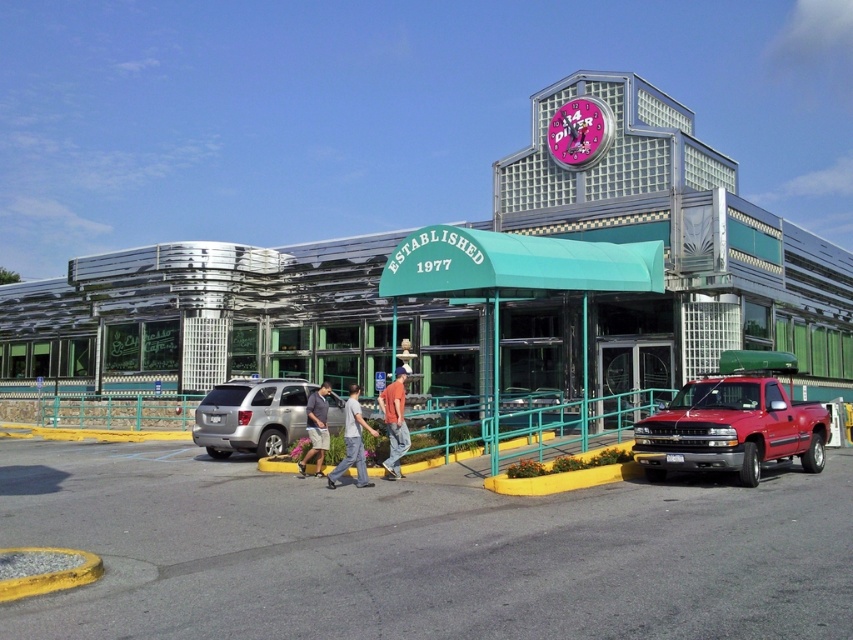
Is the position of silver metallic suv at center less distant than that of orange shirt at center?

That is False.

Is silver metallic suv at center taller than orange shirt at center?

No, silver metallic suv at center is not taller than orange shirt at center.

Image resolution: width=853 pixels, height=640 pixels. I want to click on silver metallic suv at center, so click(x=251, y=417).

Where is `silver metallic suv at center`? The height and width of the screenshot is (640, 853). silver metallic suv at center is located at coordinates (251, 417).

Can you confirm if metallic red truck at lower right is shorter than silver metallic suv at center?

Indeed, metallic red truck at lower right has a lesser height compared to silver metallic suv at center.

Is point (738, 356) positioned behind point (235, 419)?

Yes, point (738, 356) is behind point (235, 419).

Describe the element at coordinates (734, 420) in the screenshot. Image resolution: width=853 pixels, height=640 pixels. I see `metallic red truck at lower right` at that location.

The width and height of the screenshot is (853, 640). I want to click on metallic red truck at lower right, so click(734, 420).

Who is positioned more to the right, asphalt at lower center or metallic glass building at center?

asphalt at lower center is more to the right.

Can you confirm if asphalt at lower center is thinner than metallic glass building at center?

Correct, asphalt at lower center's width is less than metallic glass building at center's.

This screenshot has width=853, height=640. I want to click on asphalt at lower center, so click(x=421, y=552).